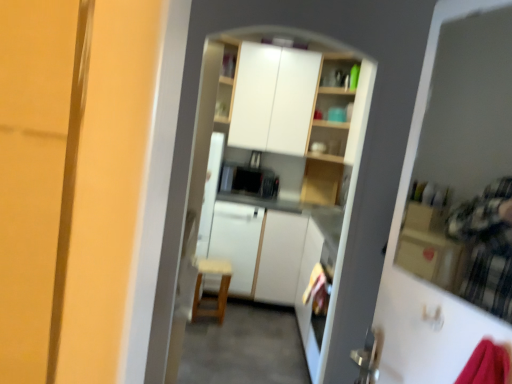
Identify the location of white matte cabinet at center, the second cabinetry viewed from the top. The width and height of the screenshot is (512, 384). (259, 250).

Measure the distance between point (203,315) and camera.

3.74 meters.

The height and width of the screenshot is (384, 512). Describe the element at coordinates (273, 98) in the screenshot. I see `white glossy cabinets at upper center, marked as the first cabinetry in a top-to-bottom arrangement` at that location.

Image resolution: width=512 pixels, height=384 pixels. In order to click on transparent plastic screen door at upper right in this screenshot , I will do `click(452, 203)`.

At what (x,y) coordinates should I click in order to perform the action: click on the 1st cabinetry counting from the left side of the transparent plastic screen door at upper right. Please return your answer as a coordinate pair (x, y). The height and width of the screenshot is (384, 512). Looking at the image, I should click on (273, 98).

Is transparent plastic screen door at upper right to the left of white glossy cabinets at upper center, the second cabinetry positioned from the bottom, from the viewer's perspective?

Incorrect, transparent plastic screen door at upper right is not on the left side of white glossy cabinets at upper center, the second cabinetry positioned from the bottom.

Is point (429, 107) more distant than point (288, 141)?

No, (429, 107) is closer to viewer.

Considering the sizes of transparent plastic screen door at upper right and white glossy cabinets at upper center, marked as the first cabinetry in a top-to-bottom arrangement, in the image, is transparent plastic screen door at upper right taller or shorter than white glossy cabinets at upper center, marked as the first cabinetry in a top-to-bottom arrangement,?

transparent plastic screen door at upper right is shorter than white glossy cabinets at upper center, marked as the first cabinetry in a top-to-bottom arrangement.

Do you think white glossy cabinets at upper center, the second cabinetry positioned from the bottom, is within wooden chair at center, or outside of it?

white glossy cabinets at upper center, the second cabinetry positioned from the bottom, is not inside wooden chair at center, it's outside.

From a real-world perspective, is white glossy cabinets at upper center, marked as the first cabinetry in a top-to-bottom arrangement, positioned above or below wooden chair at center?

white glossy cabinets at upper center, marked as the first cabinetry in a top-to-bottom arrangement, is above wooden chair at center.

Does white glossy cabinets at upper center, the second cabinetry positioned from the bottom, have a smaller size compared to wooden chair at center?

No.

Looking at this image, between white glossy cabinets at upper center, the second cabinetry positioned from the bottom, and wooden chair at center, which one has larger width?

white glossy cabinets at upper center, the second cabinetry positioned from the bottom, is wider.

Considering the positions of point (248, 89) and point (295, 285), is point (248, 89) closer or farther from the camera than point (295, 285)?

Point (248, 89).

Considering the positions of objects white glossy cabinets at upper center, the second cabinetry positioned from the bottom, and white matte cabinet at center, the second cabinetry viewed from the top, in the image provided, who is behind, white glossy cabinets at upper center, the second cabinetry positioned from the bottom, or white matte cabinet at center, the second cabinetry viewed from the top,?

white matte cabinet at center, the second cabinetry viewed from the top, is more distant.

Looking at this image, is white glossy cabinets at upper center, the second cabinetry positioned from the bottom, bigger or smaller than white matte cabinet at center, the second cabinetry viewed from the top?

In the image, white glossy cabinets at upper center, the second cabinetry positioned from the bottom, appears to be larger than white matte cabinet at center, the second cabinetry viewed from the top.

Is white matte cabinet at center, the second cabinetry viewed from the top, inside the boundaries of wooden chair at center, or outside?

white matte cabinet at center, the second cabinetry viewed from the top, exists outside the volume of wooden chair at center.

Locate an element on the screen. The image size is (512, 384). the 1st cabinetry directly above the wooden chair at center (from a real-world perspective) is located at coordinates pos(259,250).

Consider the image. Can you confirm if white matte cabinet at center, which is the 1th cabinetry from bottom to top, is wider than wooden chair at center?

Yes, white matte cabinet at center, which is the 1th cabinetry from bottom to top, is wider than wooden chair at center.

Considering the sizes of objects wooden chair at center and white matte cabinet at center, which is the 1th cabinetry from bottom to top, in the image provided, who is smaller, wooden chair at center or white matte cabinet at center, which is the 1th cabinetry from bottom to top,?

wooden chair at center.

Which object is positioned more to the right, wooden chair at center or white matte cabinet at center, which is the 1th cabinetry from bottom to top?

white matte cabinet at center, which is the 1th cabinetry from bottom to top.

Between point (194, 314) and point (265, 270), which one is positioned in front?

The point (194, 314) is closer to the camera.

In terms of height, does wooden chair at center look taller or shorter compared to white matte cabinet at center, which is the 1th cabinetry from bottom to top?

Clearly, wooden chair at center is shorter compared to white matte cabinet at center, which is the 1th cabinetry from bottom to top.

Based on the photo, what's the angular difference between transparent plastic screen door at upper right and white matte cabinet at center, the second cabinetry viewed from the top,'s facing directions?

74.6 degrees separate the facing orientations of transparent plastic screen door at upper right and white matte cabinet at center, the second cabinetry viewed from the top.

In the scene shown: Does transparent plastic screen door at upper right appear on the right side of white matte cabinet at center, which is the 1th cabinetry from bottom to top?

Correct, you'll find transparent plastic screen door at upper right to the right of white matte cabinet at center, which is the 1th cabinetry from bottom to top.

Is white matte cabinet at center, the second cabinetry viewed from the top, a part of transparent plastic screen door at upper right?

No, white matte cabinet at center, the second cabinetry viewed from the top, is not a part of transparent plastic screen door at upper right.

Based on the photo, which of these two, white matte cabinet at center, the second cabinetry viewed from the top, or white glossy cabinets at upper center, marked as the first cabinetry in a top-to-bottom arrangement, is bigger?

With larger size is white glossy cabinets at upper center, marked as the first cabinetry in a top-to-bottom arrangement.

From the image's perspective, which is below, white matte cabinet at center, which is the 1th cabinetry from bottom to top, or white glossy cabinets at upper center, marked as the first cabinetry in a top-to-bottom arrangement?

From the image's view, white matte cabinet at center, which is the 1th cabinetry from bottom to top, is below.

Is white matte cabinet at center, the second cabinetry viewed from the top, oriented away from white glossy cabinets at upper center, marked as the first cabinetry in a top-to-bottom arrangement?

No, white glossy cabinets at upper center, marked as the first cabinetry in a top-to-bottom arrangement, is not at the back of white matte cabinet at center, the second cabinetry viewed from the top.

You are a GUI agent. You are given a task and a screenshot of the screen. Output one action in this format:
    pyautogui.click(x=<x>, y=<y>)
    Task: Click on the screen door below the white glossy cabinets at upper center, marked as the first cabinetry in a top-to-bottom arrangement (from the image's perspective)
    The width and height of the screenshot is (512, 384).
    Given the screenshot: What is the action you would take?
    pyautogui.click(x=452, y=203)

Find the location of a particular element. The image size is (512, 384). the 2nd cabinetry counting from the right side of the wooden chair at center is located at coordinates (273, 98).

Based on the photo, when comparing their distances from wooden chair at center, does transparent plastic screen door at upper right or white matte cabinet at center, which is the 1th cabinetry from bottom to top, seem closer?

white matte cabinet at center, which is the 1th cabinetry from bottom to top, lies closer to wooden chair at center than the other object.

Considering their positions, is wooden chair at center positioned closer to white glossy cabinets at upper center, the second cabinetry positioned from the bottom, than transparent plastic screen door at upper right?

wooden chair at center is closer to white glossy cabinets at upper center, the second cabinetry positioned from the bottom.

Which object lies further to the anchor point wooden chair at center, white glossy cabinets at upper center, the second cabinetry positioned from the bottom, or white matte cabinet at center, the second cabinetry viewed from the top?

The object further to wooden chair at center is white glossy cabinets at upper center, the second cabinetry positioned from the bottom.

Looking at this image, estimate the real-world distances between objects in this image. Which object is closer to wooden chair at center, white matte cabinet at center, which is the 1th cabinetry from bottom to top, or transparent plastic screen door at upper right?

white matte cabinet at center, which is the 1th cabinetry from bottom to top, is positioned closer to the anchor wooden chair at center.

Based on their spatial positions, is white matte cabinet at center, the second cabinetry viewed from the top, or wooden chair at center further from white glossy cabinets at upper center, the second cabinetry positioned from the bottom?

wooden chair at center.

Based on their spatial positions, is white matte cabinet at center, which is the 1th cabinetry from bottom to top, or wooden chair at center further from transparent plastic screen door at upper right?

wooden chair at center is positioned further to the anchor transparent plastic screen door at upper right.

Considering their positions, is wooden chair at center positioned closer to transparent plastic screen door at upper right than white glossy cabinets at upper center, the second cabinetry positioned from the bottom?

white glossy cabinets at upper center, the second cabinetry positioned from the bottom, is closer to transparent plastic screen door at upper right.

Consider the image. Based on their spatial positions, is transparent plastic screen door at upper right or wooden chair at center further from white glossy cabinets at upper center, marked as the first cabinetry in a top-to-bottom arrangement?

The object further to white glossy cabinets at upper center, marked as the first cabinetry in a top-to-bottom arrangement, is transparent plastic screen door at upper right.

Locate an element on the screen. The width and height of the screenshot is (512, 384). cabinetry between white glossy cabinets at upper center, the second cabinetry positioned from the bottom, and wooden chair at center, in the vertical direction is located at coordinates tap(259, 250).

Locate an element on the screen. Image resolution: width=512 pixels, height=384 pixels. cabinetry located between transparent plastic screen door at upper right and white matte cabinet at center, which is the 1th cabinetry from bottom to top, in the depth direction is located at coordinates (273, 98).

Image resolution: width=512 pixels, height=384 pixels. I want to click on chair between transparent plastic screen door at upper right and white matte cabinet at center, which is the 1th cabinetry from bottom to top, along the z-axis, so click(x=219, y=288).

Find the location of a particular element. This screenshot has height=384, width=512. chair located between transparent plastic screen door at upper right and white glossy cabinets at upper center, marked as the first cabinetry in a top-to-bottom arrangement, in the depth direction is located at coordinates (219, 288).